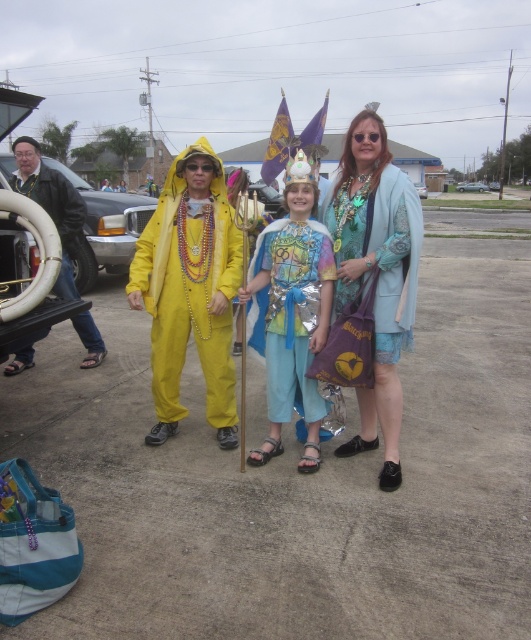
Does shiny yellow jumpsuit at center have a larger size compared to matte yellow jumpsuit at center?

No, shiny yellow jumpsuit at center is not bigger than matte yellow jumpsuit at center.

Is shiny yellow jumpsuit at center closer to camera compared to matte yellow jumpsuit at center?

That is True.

You are a GUI agent. You are given a task and a screenshot of the screen. Output one action in this format:
    pyautogui.click(x=<x>, y=<y>)
    Task: Click on the shiny yellow jumpsuit at center
    
    Given the screenshot: What is the action you would take?
    pyautogui.click(x=371, y=285)

Find the location of a particular element. Image resolution: width=531 pixels, height=640 pixels. shiny yellow jumpsuit at center is located at coordinates (371, 285).

Measure the distance between point (191,209) and camera.

Point (191,209) and camera are 3.56 meters apart.

Is the position of matte yellow jumpsuit at center more distant than that of shiny metallic cape at center?

Yes.

Where is `matte yellow jumpsuit at center`? Image resolution: width=531 pixels, height=640 pixels. matte yellow jumpsuit at center is located at coordinates (191, 289).

Which is above, shiny yellow jumpsuit at center or metallic silver car at left?

metallic silver car at left is higher up.

Can you confirm if shiny yellow jumpsuit at center is smaller than metallic silver car at left?

Incorrect, shiny yellow jumpsuit at center is not smaller in size than metallic silver car at left.

The width and height of the screenshot is (531, 640). What do you see at coordinates (371, 285) in the screenshot? I see `shiny yellow jumpsuit at center` at bounding box center [371, 285].

At what (x,y) coordinates should I click in order to perform the action: click on shiny yellow jumpsuit at center. Please return your answer as a coordinate pair (x, y). Looking at the image, I should click on (371, 285).